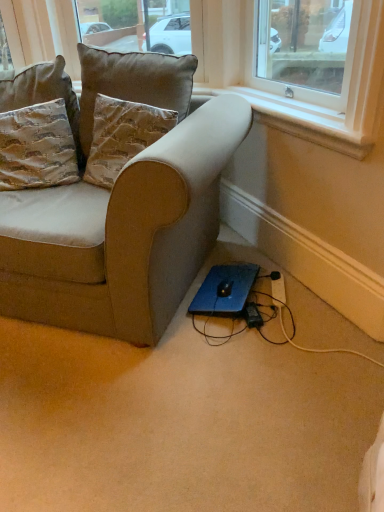
Identify the location of white plastic window sill at upper right. (310, 132).

The width and height of the screenshot is (384, 512). In order to click on camouflage fabric pillow at left, the first pillow from the left in this screenshot , I will do `click(37, 147)`.

Find the location of `black plastic extension cord at lower right`. black plastic extension cord at lower right is located at coordinates (278, 289).

Is white plastic window sill at upper right closer to camera compared to suede beige couch at lower left?

No, the depth of white plastic window sill at upper right is greater than that of suede beige couch at lower left.

Does white plastic window sill at upper right have a lesser width compared to suede beige couch at lower left?

Indeed, white plastic window sill at upper right has a lesser width compared to suede beige couch at lower left.

Between white plastic window sill at upper right and suede beige couch at lower left, which one has smaller size?

white plastic window sill at upper right is smaller.

Considering the relative sizes of velvet textured pillow at upper left, the first pillow from the right, and black plastic extension cord at lower right in the image provided, is velvet textured pillow at upper left, the first pillow from the right, shorter than black plastic extension cord at lower right?

Incorrect, the height of velvet textured pillow at upper left, the first pillow from the right, does not fall short of that of black plastic extension cord at lower right.

From the image's perspective, which one is positioned higher, velvet textured pillow at upper left, the first pillow from the right, or black plastic extension cord at lower right?

velvet textured pillow at upper left, the first pillow from the right.

From a real-world perspective, between velvet textured pillow at upper left, the 3th pillow from the left, and black plastic extension cord at lower right, who is vertically higher?

velvet textured pillow at upper left, the 3th pillow from the left, from a real-world perspective.

What are the coordinates of `the 3rd pillow positioned above the black plastic extension cord at lower right (from the image's perspective)` in the screenshot? It's located at pyautogui.click(x=132, y=83).

Is velvet textured pillow at upper left, the first pillow from the right, directly adjacent to suede beige couch at lower left?

No, velvet textured pillow at upper left, the first pillow from the right, is not beside suede beige couch at lower left.

Is velvet textured pillow at upper left, the 3th pillow from the left, bigger or smaller than suede beige couch at lower left?

velvet textured pillow at upper left, the 3th pillow from the left, is smaller than suede beige couch at lower left.

Does velvet textured pillow at upper left, the first pillow from the right, appear on the left side of suede beige couch at lower left?

No.

Which point is more forward, (156,79) or (97,212)?

Positioned in front is point (97,212).

Is white plastic window sill at upper right touching black plastic extension cord at lower right?

No, white plastic window sill at upper right is not in contact with black plastic extension cord at lower right.

Which of these two, white plastic window sill at upper right or black plastic extension cord at lower right, stands taller?

white plastic window sill at upper right is taller.

Is white plastic window sill at upper right wider than black plastic extension cord at lower right?

Incorrect, the width of white plastic window sill at upper right does not surpass that of black plastic extension cord at lower right.

Does point (313, 127) come farther from viewer compared to point (282, 304)?

No.

Based on the photo, in the image, is suede beige couch at lower left on the left side or the right side of camouflage fabric pillow at left, the first pillow from the left?

suede beige couch at lower left is to the right of camouflage fabric pillow at left, the first pillow from the left.

Does suede beige couch at lower left have a lesser height compared to camouflage fabric pillow at left, the first pillow from the left?

In fact, suede beige couch at lower left may be taller than camouflage fabric pillow at left, the first pillow from the left.

In order to click on studio couch below the camouflage fabric pillow at left, the first pillow from the left (from the image's perspective) in this screenshot , I will do `click(124, 212)`.

From a real-world perspective, is suede beige couch at lower left physically below camouflage fabric pillow at left, the third pillow positioned from the right?

Yes.

Looking at this image, is velvet textured pillow at upper left, the 3th pillow from the left, taller than black plastic plug at lower center?

Indeed, velvet textured pillow at upper left, the 3th pillow from the left, has a greater height compared to black plastic plug at lower center.

Is velvet textured pillow at upper left, the first pillow from the right, at the right side of black plastic plug at lower center?

Answer: Incorrect, velvet textured pillow at upper left, the first pillow from the right, is not on the right side of black plastic plug at lower center.

Is velvet textured pillow at upper left, the first pillow from the right, facing towards black plastic plug at lower center?

No, velvet textured pillow at upper left, the first pillow from the right, does not turn towards black plastic plug at lower center.

Can you confirm if velvet textured pillow at upper left, the 3th pillow from the left, is bigger than black plastic plug at lower center?

Yes, velvet textured pillow at upper left, the 3th pillow from the left, is bigger than black plastic plug at lower center.

How much distance is there between black plastic extension cord at lower right and velvet textured pillow at upper left, the 3th pillow from the left?

The distance of black plastic extension cord at lower right from velvet textured pillow at upper left, the 3th pillow from the left, is 1.05 meters.

Is black plastic extension cord at lower right at the left side of velvet textured pillow at upper left, the 3th pillow from the left?

No.

Choose the correct answer: Is black plastic extension cord at lower right inside velvet textured pillow at upper left, the 3th pillow from the left, or outside it?

black plastic extension cord at lower right is spatially situated outside velvet textured pillow at upper left, the 3th pillow from the left.

Looking at the image, does black plastic extension cord at lower right seem bigger or smaller compared to velvet textured pillow at upper left, the first pillow from the right?

Considering their sizes, black plastic extension cord at lower right takes up less space than velvet textured pillow at upper left, the first pillow from the right.

The height and width of the screenshot is (512, 384). Identify the location of studio couch directly beneath the white plastic window sill at upper right (from a real-world perspective). (124, 212).

Where is `extension cord located on the right of velvet textured pillow at upper left, the 3th pillow from the left`? This screenshot has width=384, height=512. extension cord located on the right of velvet textured pillow at upper left, the 3th pillow from the left is located at coordinates (278, 289).

When comparing their distances from white plastic window sill at upper right, does camouflage fabric pillow at left, the third pillow positioned from the right, or velvet textured pillow at upper left, the first pillow from the right, seem closer?

velvet textured pillow at upper left, the first pillow from the right, lies closer to white plastic window sill at upper right than the other object.

Considering their positions, is camouflage fabric pillow at left, the first pillow from the left, positioned closer to suede beige couch at lower left than suede textured pillow at upper left, the second pillow from the right?

Among the two, suede textured pillow at upper left, the second pillow from the right, is located nearer to suede beige couch at lower left.

Looking at the image, which one is located closer to suede textured pillow at upper left, the second pillow from the left, camouflage fabric pillow at left, the first pillow from the left, or black plastic extension cord at lower right?

Based on the image, camouflage fabric pillow at left, the first pillow from the left, appears to be nearer to suede textured pillow at upper left, the second pillow from the left.

From the image, which object appears to be farther from black plastic plug at lower center, white plastic window sill at upper right or velvet textured pillow at upper left, the first pillow from the right?

velvet textured pillow at upper left, the first pillow from the right, lies further to black plastic plug at lower center than the other object.

Considering their positions, is velvet textured pillow at upper left, the 3th pillow from the left, positioned closer to suede textured pillow at upper left, the second pillow from the left, than black plastic extension cord at lower right?

Based on the image, velvet textured pillow at upper left, the 3th pillow from the left, appears to be nearer to suede textured pillow at upper left, the second pillow from the left.

When comparing their distances from black plastic plug at lower center, does suede textured pillow at upper left, the second pillow from the right, or velvet textured pillow at upper left, the first pillow from the right, seem further?

Among the two, velvet textured pillow at upper left, the first pillow from the right, is located further to black plastic plug at lower center.

Considering their positions, is black plastic plug at lower center positioned further to suede textured pillow at upper left, the second pillow from the left, than suede beige couch at lower left?

Based on the image, black plastic plug at lower center appears to be further to suede textured pillow at upper left, the second pillow from the left.

Looking at the image, which one is located closer to black plastic plug at lower center, black plastic extension cord at lower right or velvet textured pillow at upper left, the first pillow from the right?

black plastic extension cord at lower right is closer to black plastic plug at lower center.

Locate an element on the screen. extension cord between suede textured pillow at upper left, the second pillow from the left, and black plastic plug at lower center from top to bottom is located at coordinates (278, 289).

You are a GUI agent. You are given a task and a screenshot of the screen. Output one action in this format:
    pyautogui.click(x=<x>, y=<y>)
    Task: Click on the window sill between velvet textured pillow at upper left, the first pillow from the right, and black plastic extension cord at lower right from top to bottom
    The height and width of the screenshot is (512, 384).
    Given the screenshot: What is the action you would take?
    pyautogui.click(x=310, y=132)

Locate an element on the screen. window sill situated between suede beige couch at lower left and black plastic extension cord at lower right from left to right is located at coordinates (310, 132).

Identify the location of plug between camouflage fabric pillow at left, the first pillow from the left, and white plastic window sill at upper right from left to right. This screenshot has width=384, height=512. (252, 315).